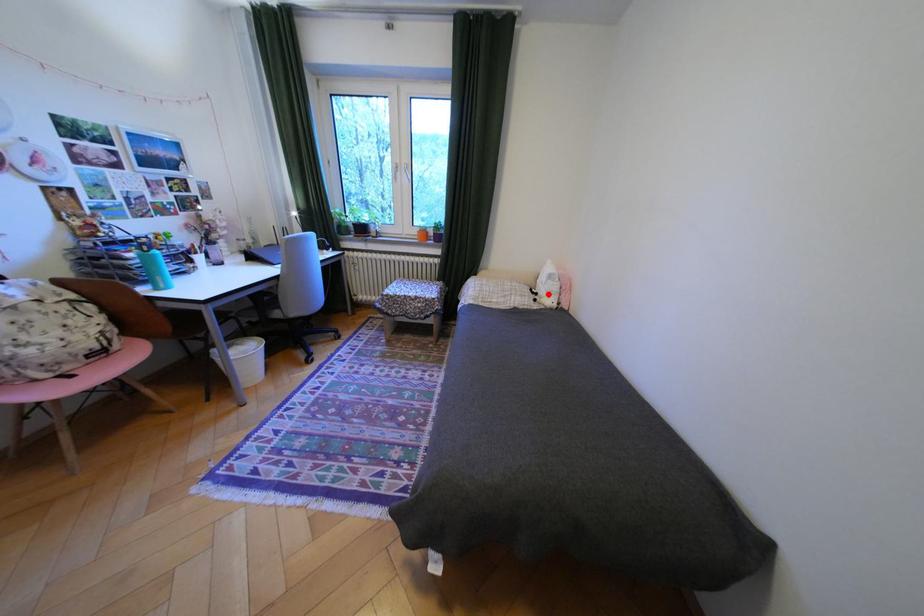
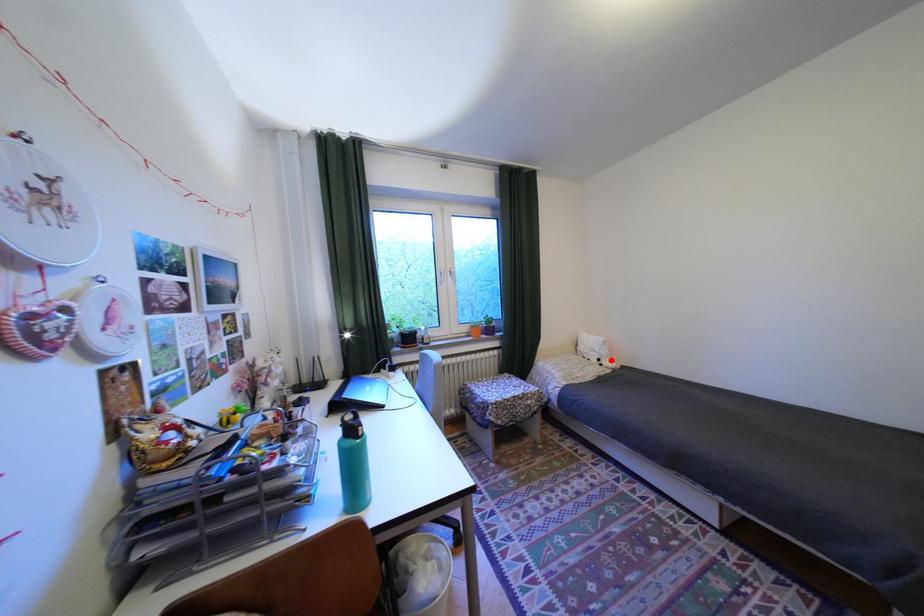
I am providing you with two images of the same scene from different viewpoints. A red point is marked on the first image and another point is marked on the second image. Do the highlighted points in image1 and image2 indicate the same real-world spot?

Yes